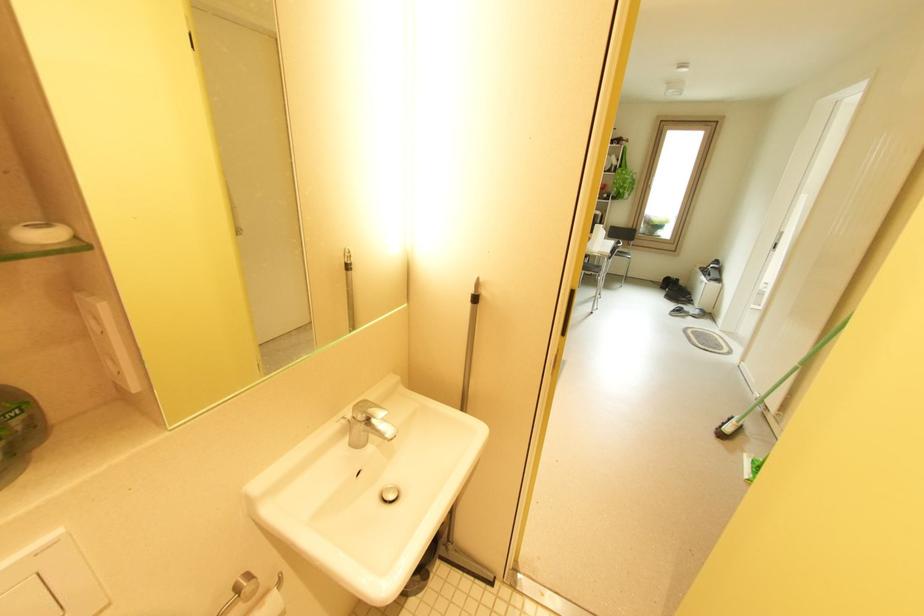
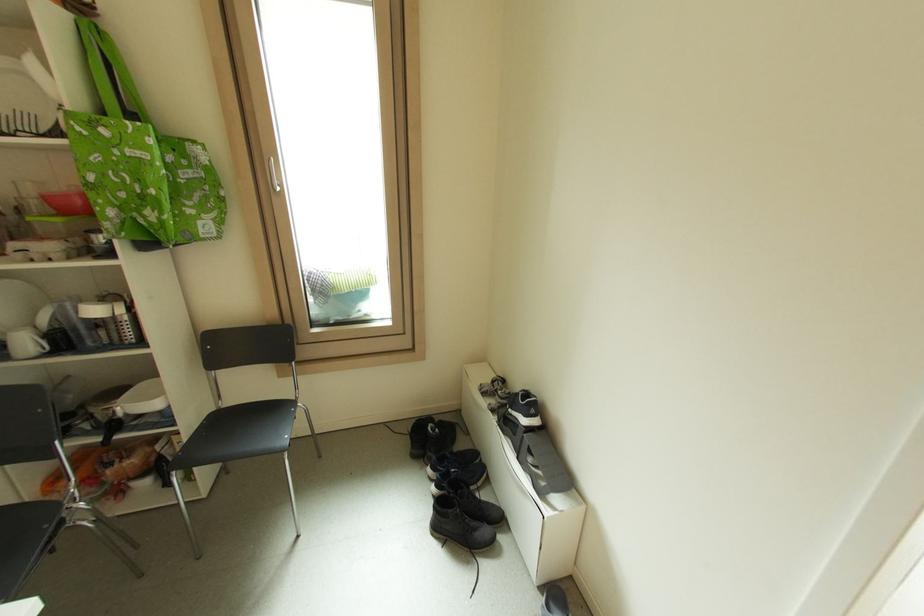
Locate, in the second image, the point that corresponds to the point at 689,300 in the first image.

(490, 532)